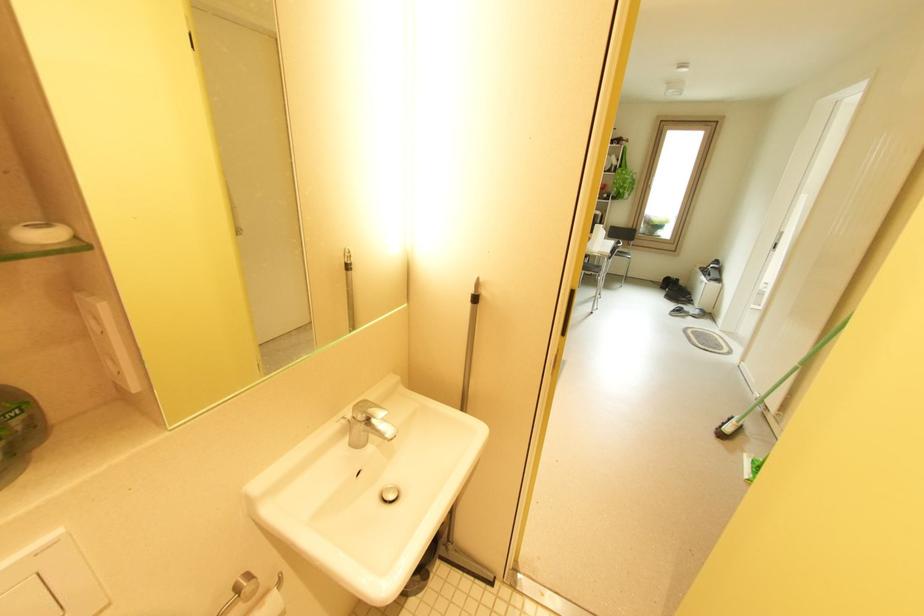
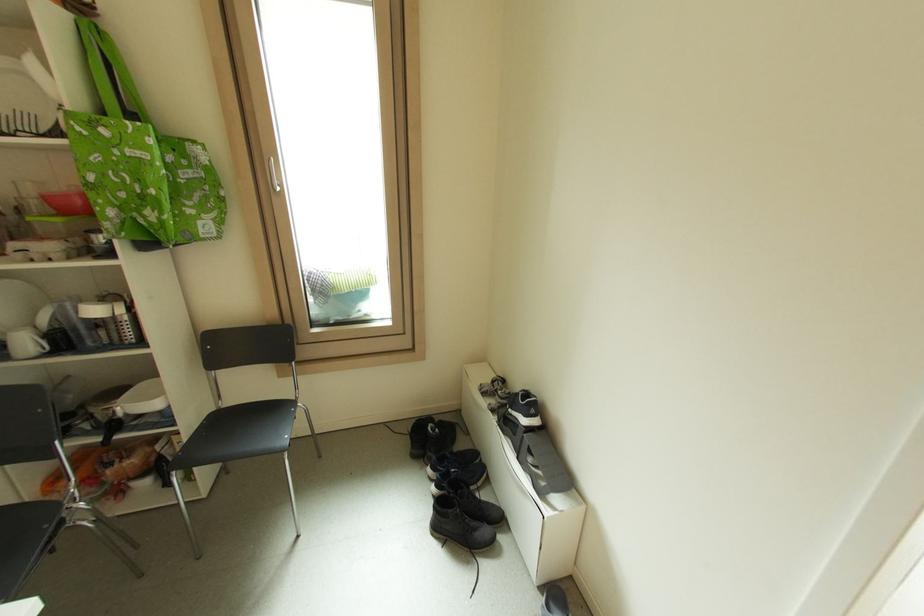
Locate, in the second image, the point that corresponds to the point at 689,300 in the first image.

(490, 532)